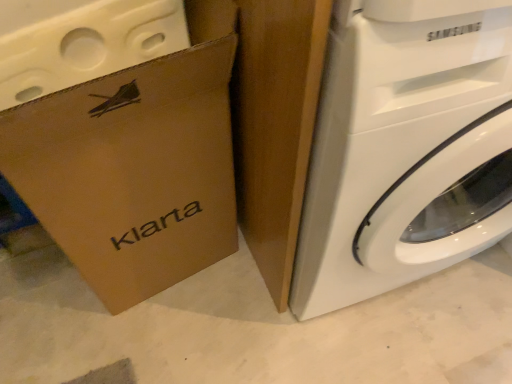
At what (x,y) coordinates should I click in order to perform the action: click on vacant area that lies between white glossy washing machine at right and brown cardboard box at left. Please return your answer as a coordinate pair (x, y). Looking at the image, I should click on (209, 331).